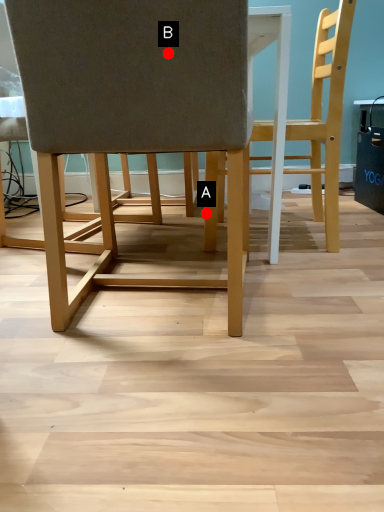
Question: Two points are circled on the image, labeled by A and B beside each circle. Which point is farther to the camera?

Choices:
 (A) A is further
 (B) B is further

Answer: (A)